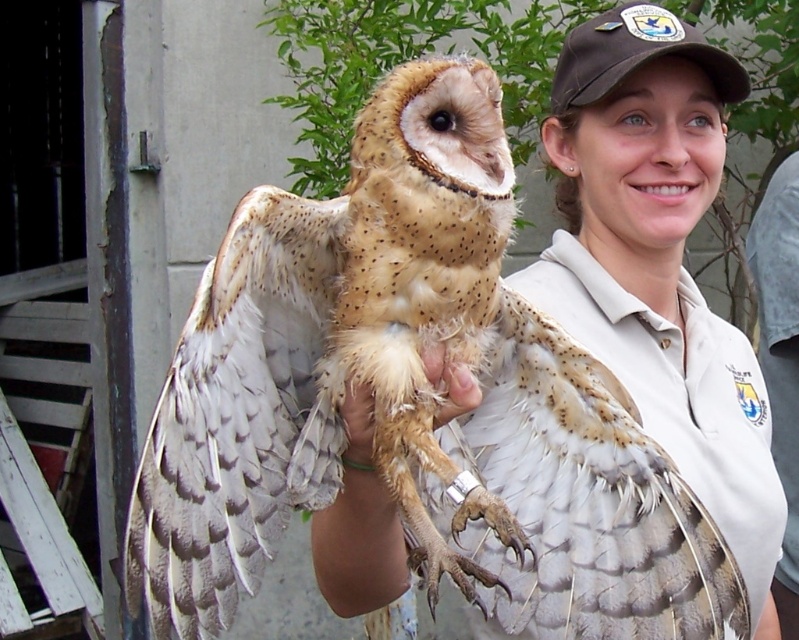
You are a wildlife photographer trying to capture the owl in the image. The camera you are using has a focus range that can only accommodate objects up to 1 meter tall. Given that the speckled feathered owl at center and the fuzzy beige feathers at center are both in the frame, will the camera be able to focus on the owl?

The speckled feathered owl at center is taller than the fuzzy beige feathers at center. Since the camera can focus on objects up to 1 meter tall, and the owl is taller than the feathers, the camera should be able to focus on the owl as long as its height is within the 1 meter limit. However, without the exact height of the owl, we can only confirm that it is taller than the feathers, but cannot definitively say if it fits within the camera range.

You are standing at the point labeled as point (233, 593) and want to take a photo of the owl. The camera you have can focus on subjects up to 1.2 meters away. Will the camera be able to focus on the owl?

The distance between point (233, 593) and the camera is 1.15 meters, which is within the camera focus range of 1.2 meters. Therefore, the camera can focus on the owl.